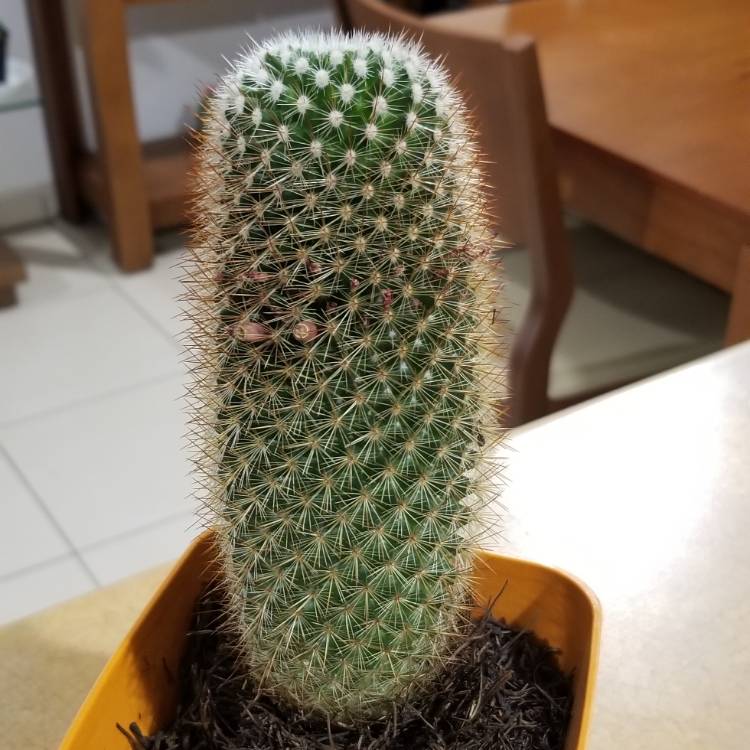
Identify the location of table legs. This screenshot has height=750, width=750. (736, 318), (130, 150), (52, 76).